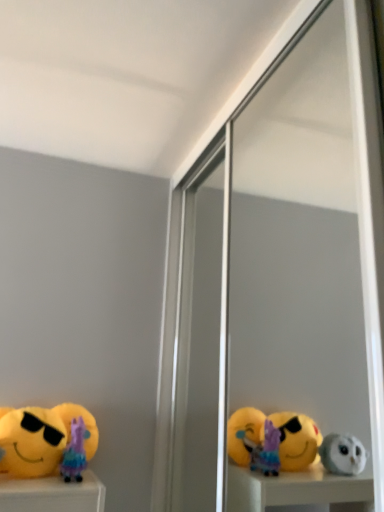
Question: From a real-world perspective, is transparent glass screen door at center on top of purple fabric doll at lower left, positioned as the second toy in left-to-right order?

Choices:
 (A) no
 (B) yes

Answer: (B)

Question: Does transparent glass screen door at center come in front of purple fabric doll at lower left, positioned as the second toy in left-to-right order?

Choices:
 (A) yes
 (B) no

Answer: (A)

Question: Is transparent glass screen door at center positioned beyond the bounds of purple fabric doll at lower left, positioned as the second toy in left-to-right order?

Choices:
 (A) yes
 (B) no

Answer: (A)

Question: From a real-world perspective, is transparent glass screen door at center beneath purple fabric doll at lower left, positioned as the second toy in left-to-right order?

Choices:
 (A) yes
 (B) no

Answer: (B)

Question: Considering the relative positions of transparent glass screen door at center and purple fabric doll at lower left, positioned as the second toy in left-to-right order, in the image provided, is transparent glass screen door at center to the right of purple fabric doll at lower left, positioned as the second toy in left-to-right order, from the viewer's perspective?

Choices:
 (A) no
 (B) yes

Answer: (B)

Question: From the image's perspective, would you say transparent glass screen door at center is positioned over purple fabric doll at lower left, which is counted as the 1th toy, starting from the right?

Choices:
 (A) yes
 (B) no

Answer: (A)

Question: Does yellow plush toy at lower left, which ranks as the 1th toy in left-to-right order, lie behind transparent glass screen door at center?

Choices:
 (A) no
 (B) yes

Answer: (B)

Question: From a real-world perspective, is yellow plush toy at lower left, acting as the second toy starting from the right, under transparent glass screen door at center?

Choices:
 (A) yes
 (B) no

Answer: (A)

Question: Is yellow plush toy at lower left, acting as the second toy starting from the right, next to transparent glass screen door at center?

Choices:
 (A) no
 (B) yes

Answer: (A)

Question: From a real-world perspective, is yellow plush toy at lower left, acting as the second toy starting from the right, on top of transparent glass screen door at center?

Choices:
 (A) no
 (B) yes

Answer: (A)

Question: Does yellow plush toy at lower left, acting as the second toy starting from the right, have a lesser height compared to transparent glass screen door at center?

Choices:
 (A) no
 (B) yes

Answer: (B)

Question: Is yellow plush toy at lower left, acting as the second toy starting from the right, positioned before transparent glass screen door at center?

Choices:
 (A) no
 (B) yes

Answer: (A)

Question: Does yellow plush toy at lower left, which ranks as the 1th toy in left-to-right order, have a lesser width compared to purple fabric doll at lower left, positioned as the second toy in left-to-right order?

Choices:
 (A) yes
 (B) no

Answer: (A)